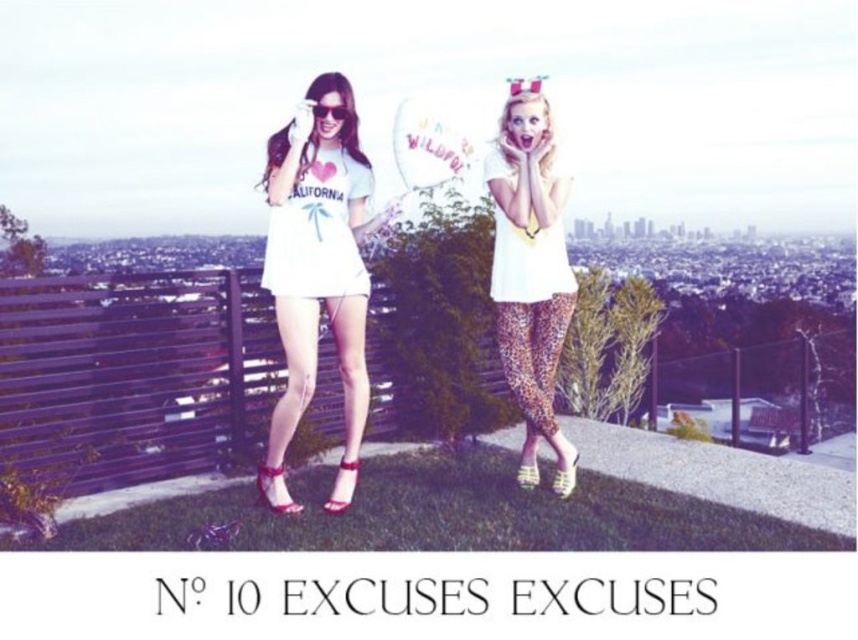
Is white leopard print dress at upper right bigger than matte black sunglasses at upper center?

Indeed, white leopard print dress at upper right has a larger size compared to matte black sunglasses at upper center.

Between white leopard print dress at upper right and matte black sunglasses at upper center, which one is positioned lower?

white leopard print dress at upper right is below.

Which is in front, point (499, 224) or point (331, 109)?

Point (331, 109) is more forward.

What are the coordinates of `white leopard print dress at upper right` in the screenshot? It's located at (529, 260).

Which is more to the left, white matte t-shirt at center or white matte dress at center?

white matte t-shirt at center is more to the left.

Between white matte t-shirt at center and white matte dress at center, which one appears on the right side from the viewer's perspective?

white matte dress at center

The image size is (858, 640). Find the location of `white matte t-shirt at center`. white matte t-shirt at center is located at coordinates (317, 275).

Is white matte dress at center further to camera compared to matte black sunglasses at upper center?

That is False.

Does white matte dress at center have a greater width compared to matte black sunglasses at upper center?

Indeed, white matte dress at center has a greater width compared to matte black sunglasses at upper center.

What are the coordinates of `white matte dress at center` in the screenshot? It's located at (317, 230).